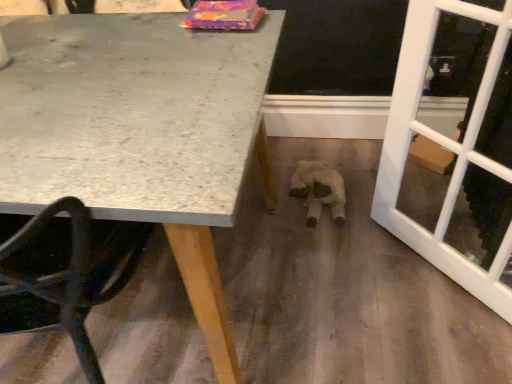
Identify the location of free point to the left of white plush toy at center. (263, 206).